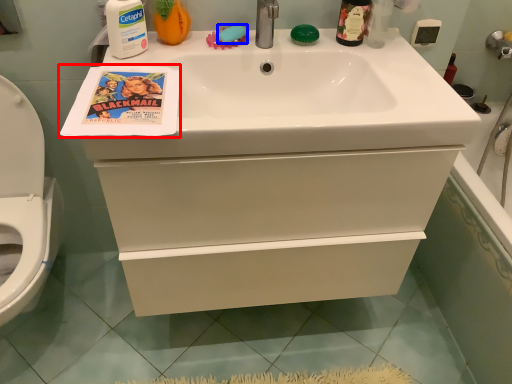
Question: Which object is closer to the camera taking this photo, comic book (highlighted by a red box) or soap (highlighted by a blue box)?

Choices:
 (A) comic book
 (B) soap

Answer: (A)